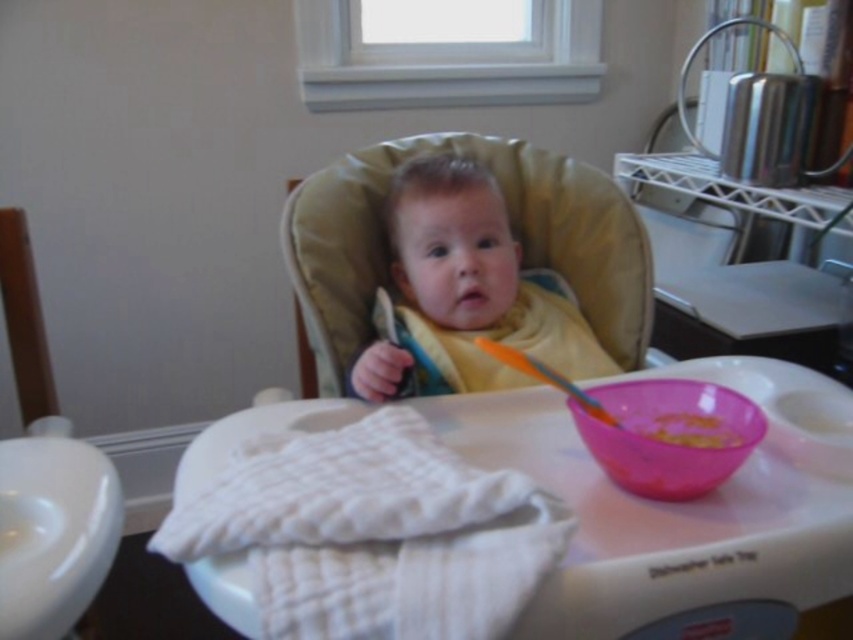
Where is the soft yellow bib at center located in the image?

The soft yellow bib at center is located at the 2D coordinates point (465, 289).

You are a parent preparing to feed your baby. You have a soft yellow bib at center and yellow matte food at center on the tray. Which item can you place on the baby without needing to adjust the size?

The soft yellow bib at center has a larger size compared to the yellow matte food at center, so the yellow bib at center can be placed on the baby without needing to adjust the size since it is bigger and more appropriate for covering the baby.

You are a parent trying to clean up after your baby. You need to place the orange plastic spoon at upper center into a drawer that can only accommodate items shorter than the white fabric at lower left. Can the spoon fit?

The white fabric at lower left is much taller than the orange plastic spoon at upper center. Since the spoon is shorter than the fabric, it should fit in the drawer.